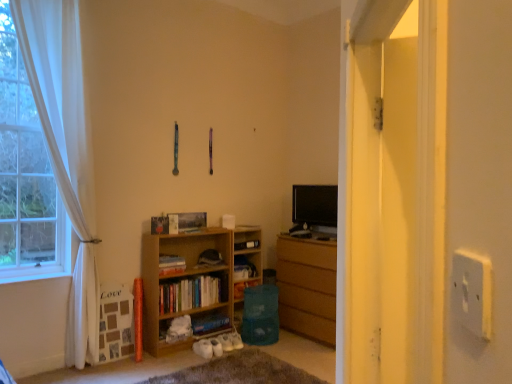
Question: In which direction should I rotate to look at hardcover book at lower center, arranged as the first book when ordered from the bottom?

Choices:
 (A) right
 (B) left

Answer: (B)

Question: Which direction should I rotate to face hardcover book at center, which is counted as the third book, starting from the bottom, — up or down?

Choices:
 (A) down
 (B) up

Answer: (A)

Question: From the image's perspective, does wooden bookshelf at center, which is the 2th book from top to bottom, appear higher than white sheer curtain at left?

Choices:
 (A) no
 (B) yes

Answer: (A)

Question: Can you confirm if wooden bookshelf at center, placed as the 2th book when sorted from bottom to top, is wider than white sheer curtain at left?

Choices:
 (A) yes
 (B) no

Answer: (A)

Question: Is wooden bookshelf at center, placed as the 2th book when sorted from bottom to top, outside of white sheer curtain at left?

Choices:
 (A) yes
 (B) no

Answer: (A)

Question: Can you confirm if wooden bookshelf at center, placed as the 2th book when sorted from bottom to top, is bigger than white sheer curtain at left?

Choices:
 (A) no
 (B) yes

Answer: (A)

Question: Does wooden bookshelf at center, which is the 2th book from top to bottom, have a lesser width compared to white sheer curtain at left?

Choices:
 (A) no
 (B) yes

Answer: (A)

Question: Considering the relative sizes of wooden bookshelf at center, which is the 2th book from top to bottom, and white sheer curtain at left in the image provided, is wooden bookshelf at center, which is the 2th book from top to bottom, shorter than white sheer curtain at left?

Choices:
 (A) no
 (B) yes

Answer: (B)

Question: Is hardcover book at center, which appears as the first book when viewed from the top, facing towards wooden bookshelf at center, placed as the 2th book when sorted from bottom to top?

Choices:
 (A) yes
 (B) no

Answer: (B)

Question: Is hardcover book at center, which is counted as the third book, starting from the bottom, further to the viewer compared to wooden bookshelf at center, placed as the 2th book when sorted from bottom to top?

Choices:
 (A) yes
 (B) no

Answer: (A)

Question: From a real-world perspective, is hardcover book at center, which is counted as the third book, starting from the bottom, under wooden bookshelf at center, which is the 2th book from top to bottom?

Choices:
 (A) no
 (B) yes

Answer: (A)

Question: Does hardcover book at center, which is counted as the third book, starting from the bottom, contain wooden bookshelf at center, which is the 2th book from top to bottom?

Choices:
 (A) yes
 (B) no

Answer: (B)

Question: Is hardcover book at center, which appears as the first book when viewed from the top, wider than wooden bookshelf at center, placed as the 2th book when sorted from bottom to top?

Choices:
 (A) yes
 (B) no

Answer: (B)

Question: From a real-world perspective, is hardcover book at center, which is counted as the third book, starting from the bottom, on top of wooden bookshelf at center, which is the 2th book from top to bottom?

Choices:
 (A) yes
 (B) no

Answer: (A)

Question: Does wooden chest of drawers at center touch transparent plastic screen door at right?

Choices:
 (A) yes
 (B) no

Answer: (B)